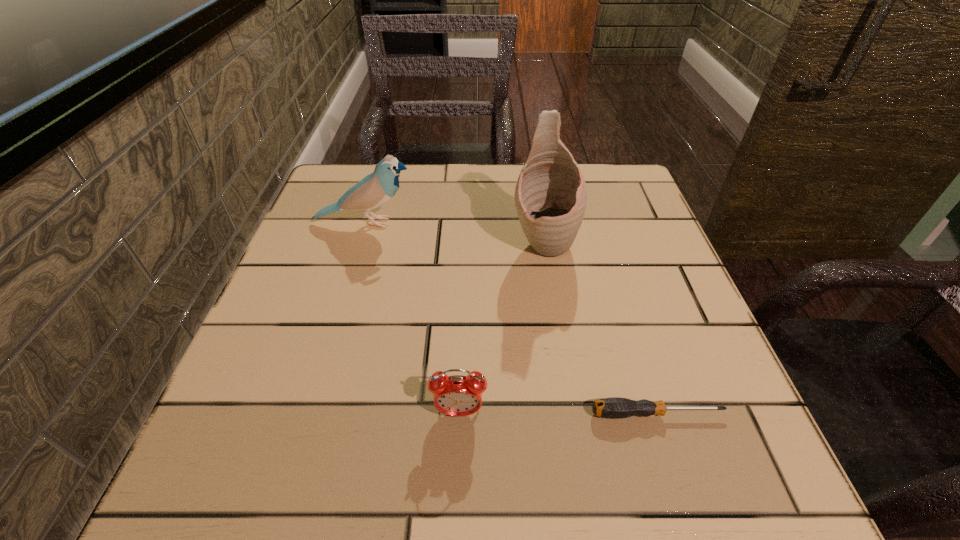
The width and height of the screenshot is (960, 540). Identify the location of object that is at the far edge. (375, 189).

This screenshot has width=960, height=540. What are the coordinates of `object that is at the left edge` in the screenshot? It's located at (375, 189).

The height and width of the screenshot is (540, 960). I want to click on object that is at the right edge, so click(x=615, y=407).

Where is `object located in the far left corner section of the desktop`? The height and width of the screenshot is (540, 960). object located in the far left corner section of the desktop is located at coordinates (375, 189).

This screenshot has height=540, width=960. Identify the location of vacant area at the far edge. (442, 200).

Where is `free space at the left edge`? The image size is (960, 540). free space at the left edge is located at coordinates (358, 288).

Locate an element on the screen. The height and width of the screenshot is (540, 960). vacant space at the right edge of the desktop is located at coordinates (668, 404).

At what (x,y) coordinates should I click in order to perform the action: click on vacant space at the far left corner of the desktop. Please return your answer as a coordinate pair (x, y). The width and height of the screenshot is (960, 540). Looking at the image, I should click on (316, 204).

The height and width of the screenshot is (540, 960). Find the location of `vacant area at the near left corner`. vacant area at the near left corner is located at coordinates (261, 472).

I want to click on vacant space at the far right corner of the desktop, so (612, 203).